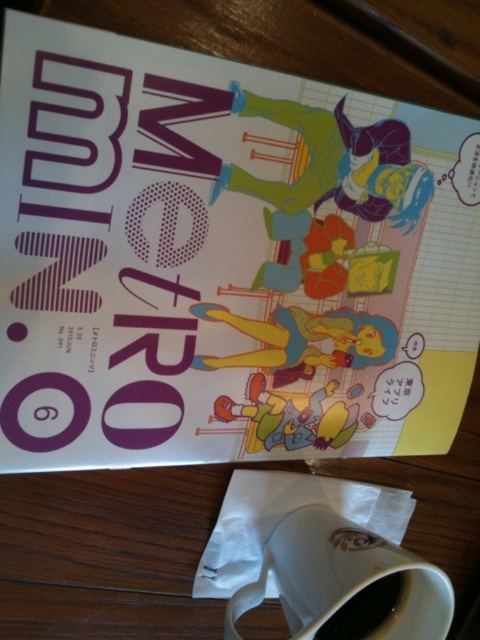
Who is positioned more to the left, matte purple comic book at center or white ceramic mug at lower center?

Positioned to the left is matte purple comic book at center.

Between matte purple comic book at center and white ceramic mug at lower center, which one has more height?

With more height is matte purple comic book at center.

What are the coordinates of `matte purple comic book at center` in the screenshot? It's located at (224, 259).